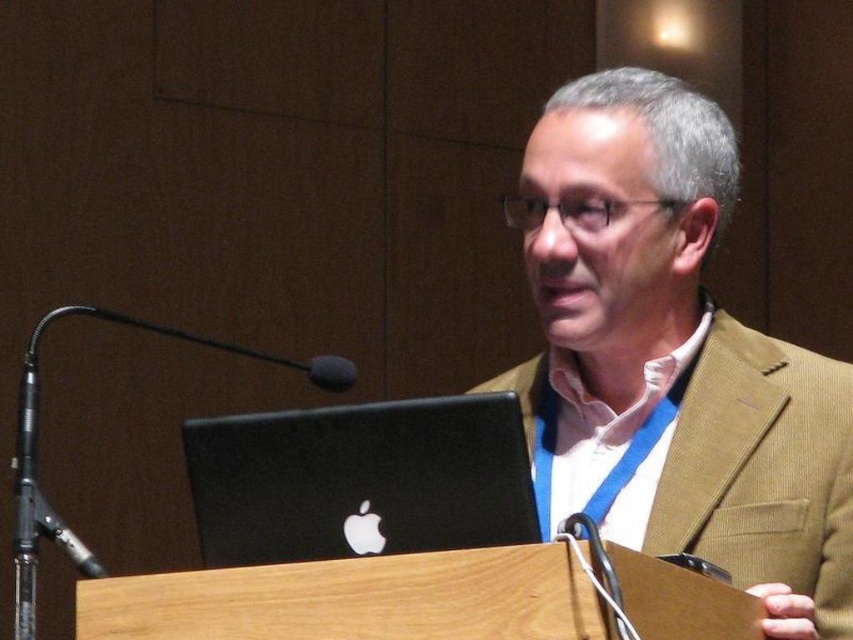
You are an event organizer setting up a stage for a presentation. The stage has limited space between the front edge and the audience. You need to ensure that the matte brown suit at center and the black matte laptop at center can both fit side by side without overlapping. Based on their widths, can they fit if the available space is 1.2 meters wide?

The matte brown suit at center might be wider than black matte laptop at center, so there is a possibility that the total width of both items exceeds 1.2 meters. Further measurement is needed to confirm.

You are an event planner setting up the stage for a speaker. You need to place a new microphone stand between the matte brown suit at center and the black matte laptop at center. Which object should the microphone stand be closer to in order to be positioned closer to the speaker?

The microphone stand should be closer to the matte brown suit at center because it is closer to the speaker than the black matte laptop at center.